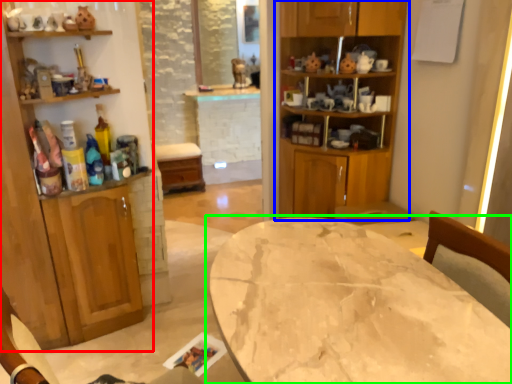
Question: Considering the real-world distances, which object is closest to cabinetry (highlighted by a red box)? cabinetry (highlighted by a blue box) or table (highlighted by a green box).

Choices:
 (A) cabinetry
 (B) table

Answer: (A)